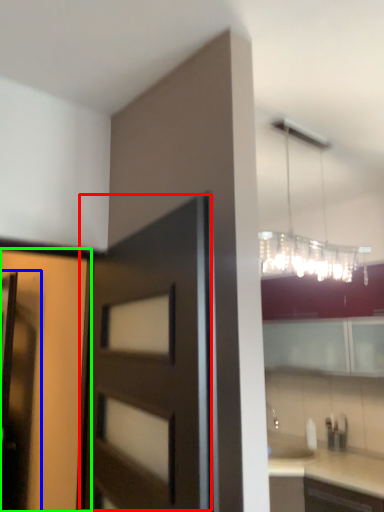
Question: Considering the real-world distances, which object is closest to door (highlighted by a red box)? screen door (highlighted by a blue box) or door (highlighted by a green box).

Choices:
 (A) screen door
 (B) door

Answer: (B)